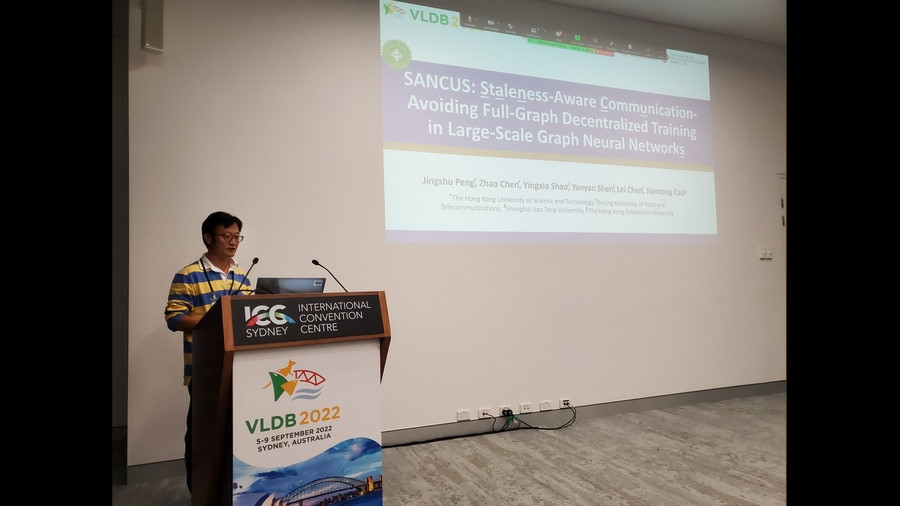
The image size is (900, 506). In order to click on mic in this screenshot , I will do `click(252, 258)`, `click(317, 258)`.